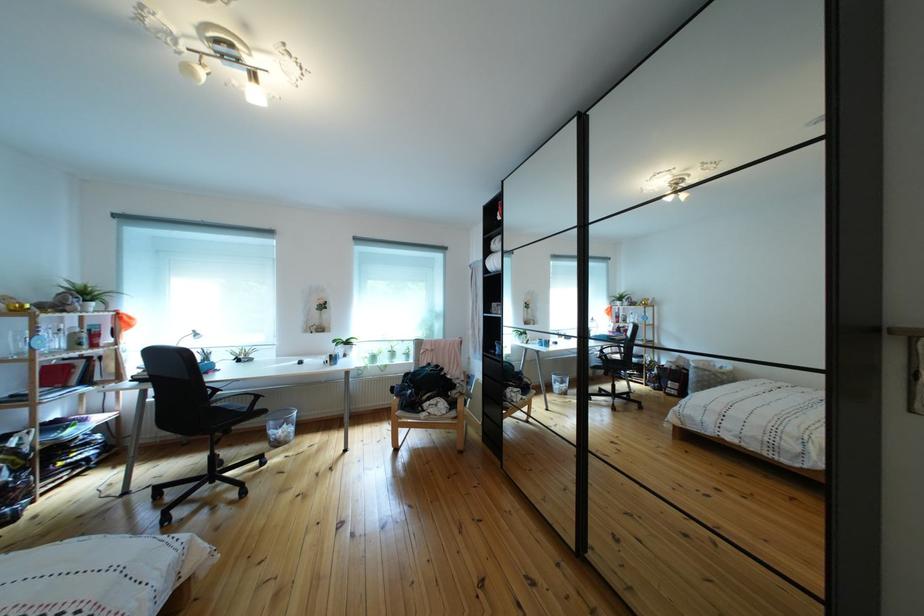
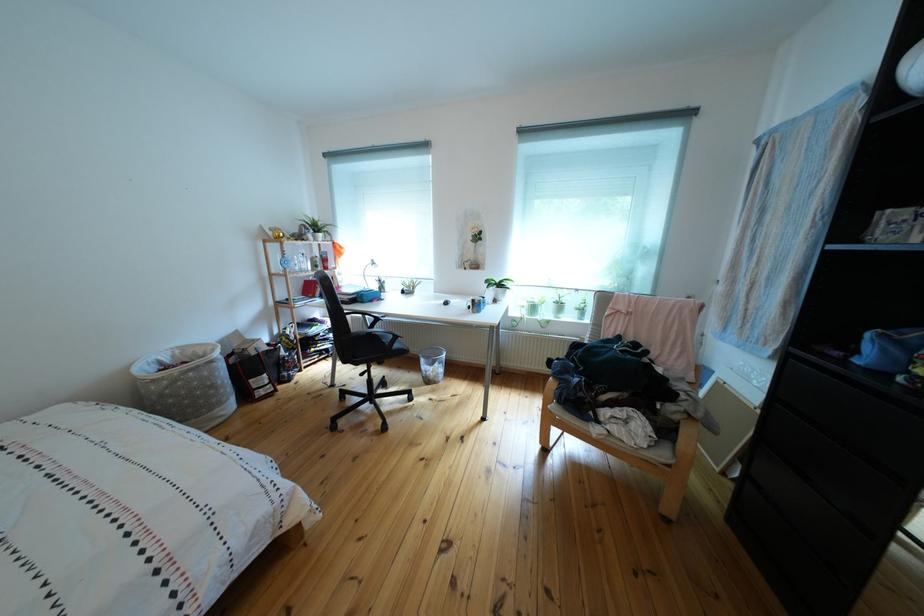
Question: Based on the continuous images, in which direction is the camera rotating? Reply with the corresponding letter.

Choices:
 (A) Left
 (B) Right
 (C) Up
 (D) Down

Answer: (A)